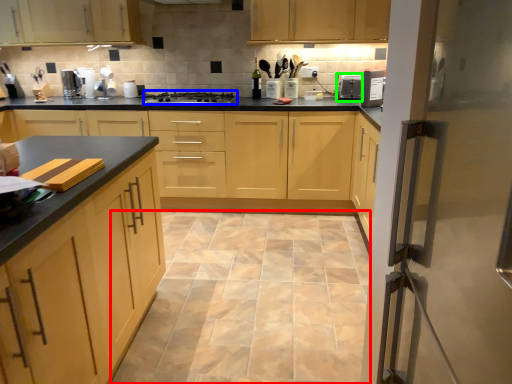
Question: Which object is the farthest from ceramic tile (highlighted by a red box)? Choose among these: gas stove (highlighted by a blue box) or appliance (highlighted by a green box).

Choices:
 (A) gas stove
 (B) appliance

Answer: (B)